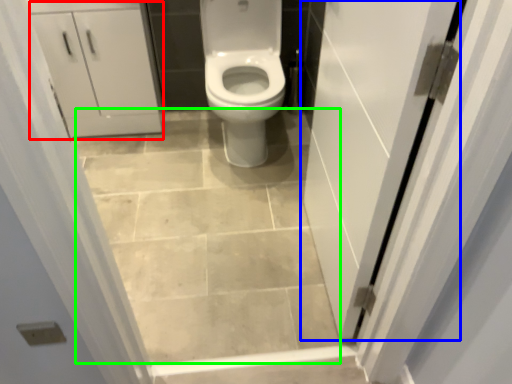
Question: Which object is the farthest from cabinetry (highlighted by a red box)? Choose among these: door (highlighted by a blue box) or ceramic tile (highlighted by a green box).

Choices:
 (A) door
 (B) ceramic tile

Answer: (A)